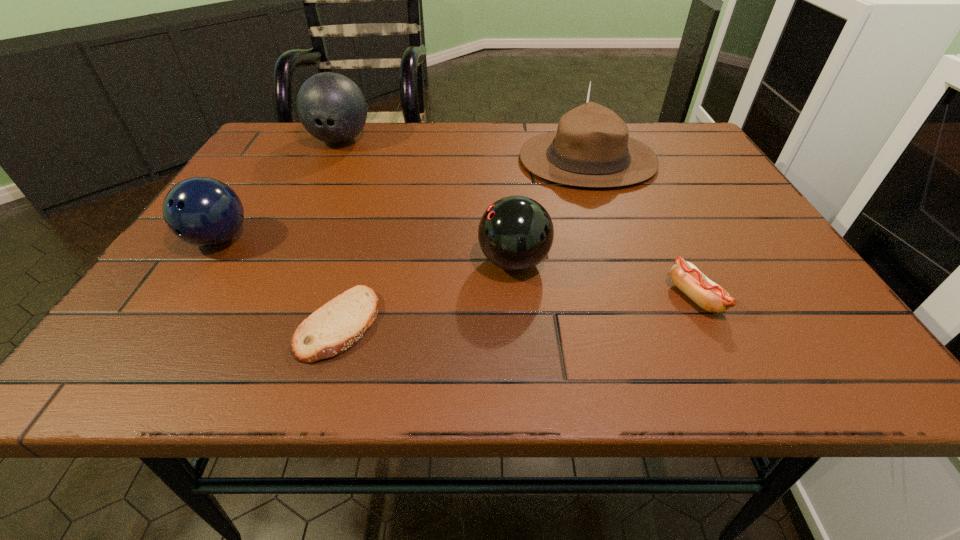
I want to click on the tallest bowling ball, so click(331, 107).

Identify the location of fedora. The width and height of the screenshot is (960, 540). [591, 148].

Find the location of `the rightmost bowling ball`. the rightmost bowling ball is located at coordinates (515, 233).

Locate an element on the screen. the fifth tallest object is located at coordinates (711, 297).

Where is `the shortest object`? The width and height of the screenshot is (960, 540). the shortest object is located at coordinates (337, 325).

Image resolution: width=960 pixels, height=540 pixels. Find the location of `free space located on the grip area of the tallest bowling ball`. free space located on the grip area of the tallest bowling ball is located at coordinates (307, 208).

This screenshot has height=540, width=960. Find the location of `free space located 0.220m on the feather side of the fedora`. free space located 0.220m on the feather side of the fedora is located at coordinates (433, 160).

Image resolution: width=960 pixels, height=540 pixels. In order to click on vacant region located on the feather side of the fedora in this screenshot , I will do `click(397, 160)`.

What are the coordinates of `vacant region located on the feather side of the fedora` in the screenshot? It's located at (444, 160).

At what (x,y) coordinates should I click in order to perform the action: click on free space located on the surface of the rightmost bowling ball near the finger holes. Please return your answer as a coordinate pair (x, y). This screenshot has height=540, width=960. Looking at the image, I should click on (317, 262).